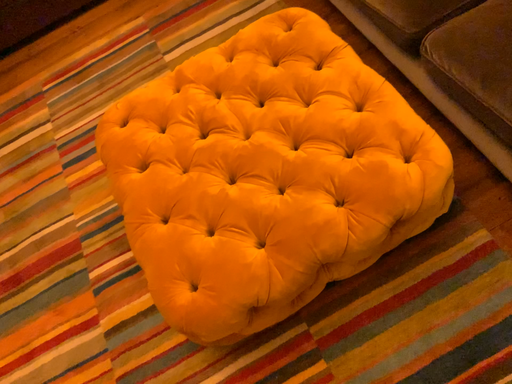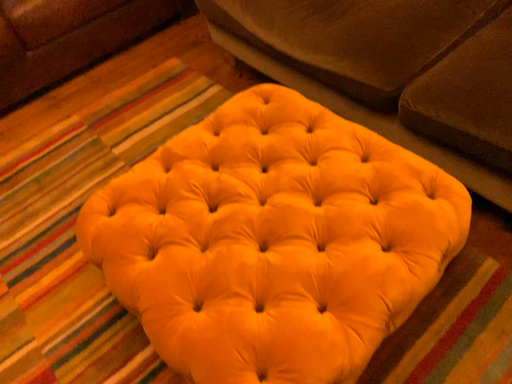
Question: How did the camera likely rotate when shooting the video?

Choices:
 (A) rotated left
 (B) rotated right

Answer: (B)